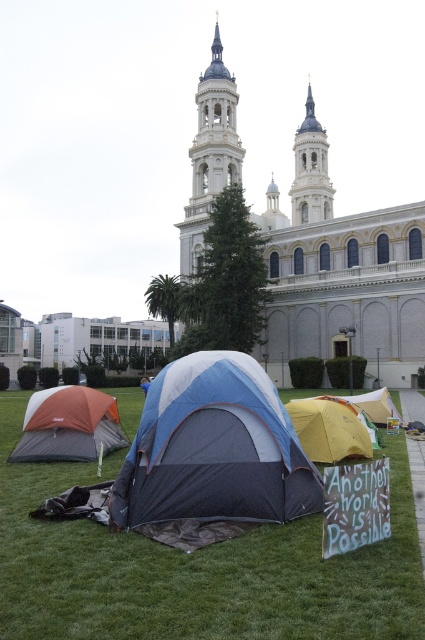
You are standing at the point with coordinates 0.5, 0.8. You want to walk towards the white stone church at center. In which direction should you move?

The white stone church at center is located at point (340,272). Since you are at (340,320), you should move slightly to the left and forward to reach it.